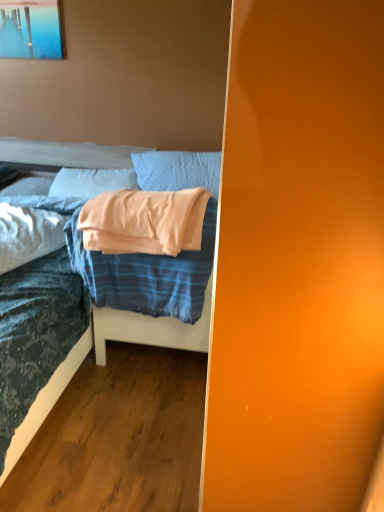
Identify the location of vacant location below blue striped fabric blanket at center (from a real-world perspective). (141, 368).